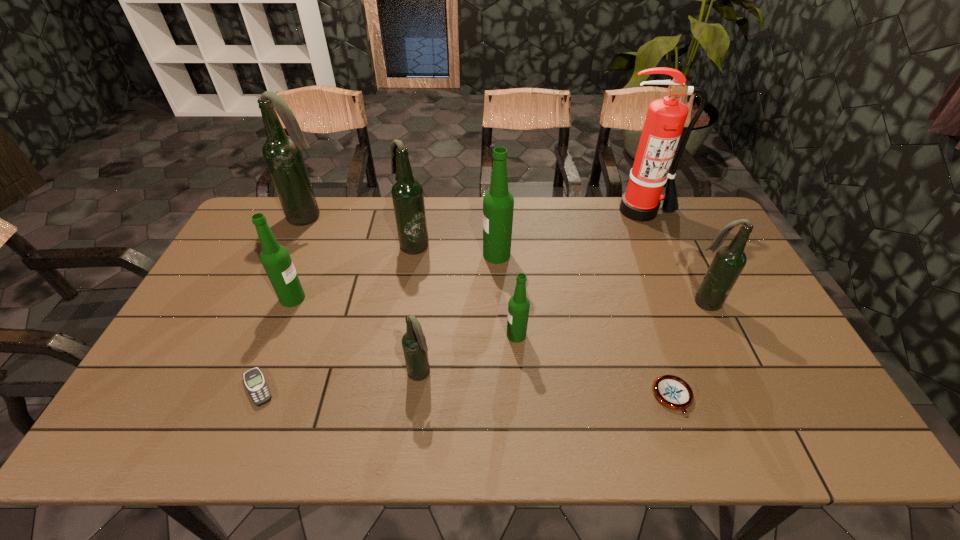
Identify the location of vacant space at the right edge of the desktop. Image resolution: width=960 pixels, height=540 pixels. (726, 331).

This screenshot has width=960, height=540. In the image, there is a desktop. Identify the location of free space at the far right corner. (677, 239).

What are the coordinates of `blank region between the rightmost beer bottle and the gray beeper` in the screenshot? It's located at (481, 345).

Where is `vacant area between the farthest beer bottle and the second nearest green beer bottle`? The width and height of the screenshot is (960, 540). vacant area between the farthest beer bottle and the second nearest green beer bottle is located at coordinates (301, 258).

Image resolution: width=960 pixels, height=540 pixels. In order to click on blank region between the second shortest object and the rightmost beer bottle in this screenshot , I will do `click(688, 349)`.

You are a GUI agent. You are given a task and a screenshot of the screen. Output one action in this format:
    pyautogui.click(x=<x>, y=<y>)
    Task: Click on the vacant region between the second biggest dark beer bottle and the beeper
    The image size is (960, 540).
    Given the screenshot: What is the action you would take?
    pyautogui.click(x=336, y=316)

Find the location of a particular element. The image size is (960, 540). blank region between the ninth tallest object and the farthest green beer bottle is located at coordinates (585, 326).

This screenshot has width=960, height=540. I want to click on vacant space in between the red fire extinguisher and the third nearest dark beer bottle, so click(528, 227).

This screenshot has height=540, width=960. What are the coordinates of `free space between the sixth farthest beer bottle and the beeper` in the screenshot? It's located at (387, 361).

You are a GUI agent. You are given a task and a screenshot of the screen. Output one action in this format:
    pyautogui.click(x=<x>, y=<y>)
    Task: Click on the blank region between the compass and the second smallest green beer bottle
    This screenshot has width=960, height=540.
    Given the screenshot: What is the action you would take?
    pyautogui.click(x=483, y=348)